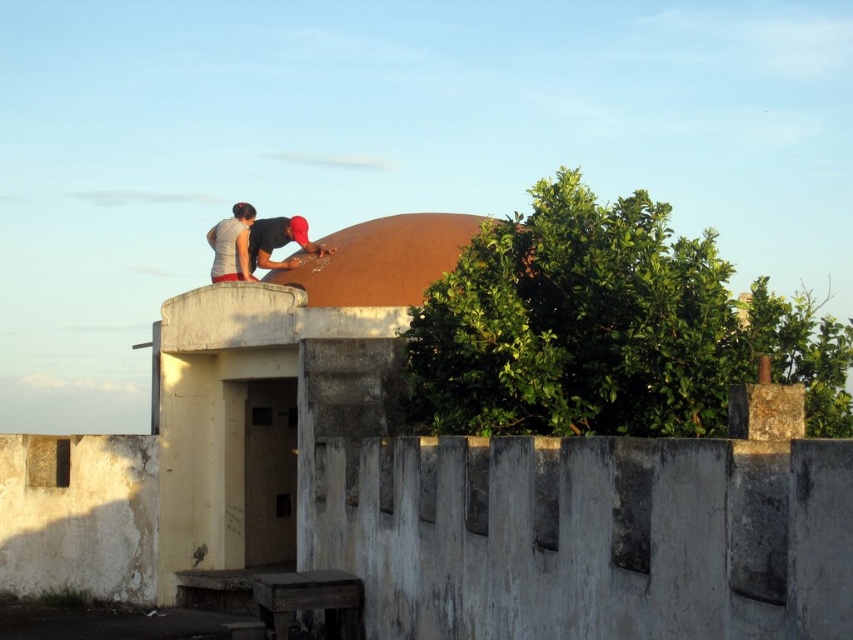
Question: Which of the following is the closest to the observer?

Choices:
 (A) matte black shirt at upper center
 (B) matte gray shirt at upper center

Answer: (B)

Question: Is the position of matte gray shirt at upper center less distant than that of matte black shirt at upper center?

Choices:
 (A) no
 (B) yes

Answer: (B)

Question: Can you confirm if matte gray shirt at upper center is positioned to the left of matte black shirt at upper center?

Choices:
 (A) yes
 (B) no

Answer: (A)

Question: Estimate the real-world distances between objects in this image. Which object is closer to the matte black shirt at upper center?

Choices:
 (A) brown matte dome at center
 (B) matte gray shirt at upper center

Answer: (B)

Question: Which object is positioned farthest from the matte gray shirt at upper center?

Choices:
 (A) matte black shirt at upper center
 (B) brown matte dome at center

Answer: (B)

Question: Is brown matte dome at center above matte gray shirt at upper center?

Choices:
 (A) yes
 (B) no

Answer: (B)